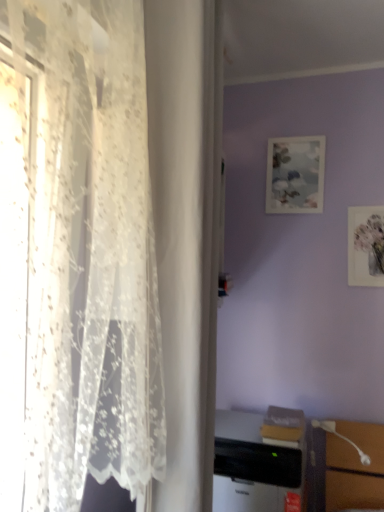
Question: From the image's perspective, relative to white glossy table lamp at lower right, is matte paper picture frame at upper right, arranged as the first picture frame when viewed from the right, above or below?

Choices:
 (A) below
 (B) above

Answer: (B)

Question: In the image, is matte paper picture frame at upper right, the 1th picture frame viewed from the front, on the left side or the right side of white glossy table lamp at lower right?

Choices:
 (A) left
 (B) right

Answer: (B)

Question: Which object is positioned closest to the white glossy table lamp at lower right?

Choices:
 (A) black plastic desktop computer at lower center
 (B) matte paper picture frame at upper center, which ranks as the second picture frame in front-to-back order
 (C) matte paper picture frame at upper right, marked as the 1th picture frame in a bottom-to-top arrangement

Answer: (A)

Question: Considering the real-world distances, which object is farthest from the black plastic desktop computer at lower center?

Choices:
 (A) matte paper picture frame at upper center, which is the first picture frame from top to bottom
 (B) white glossy table lamp at lower right
 (C) matte paper picture frame at upper right, the 2th picture frame positioned from the top

Answer: (A)